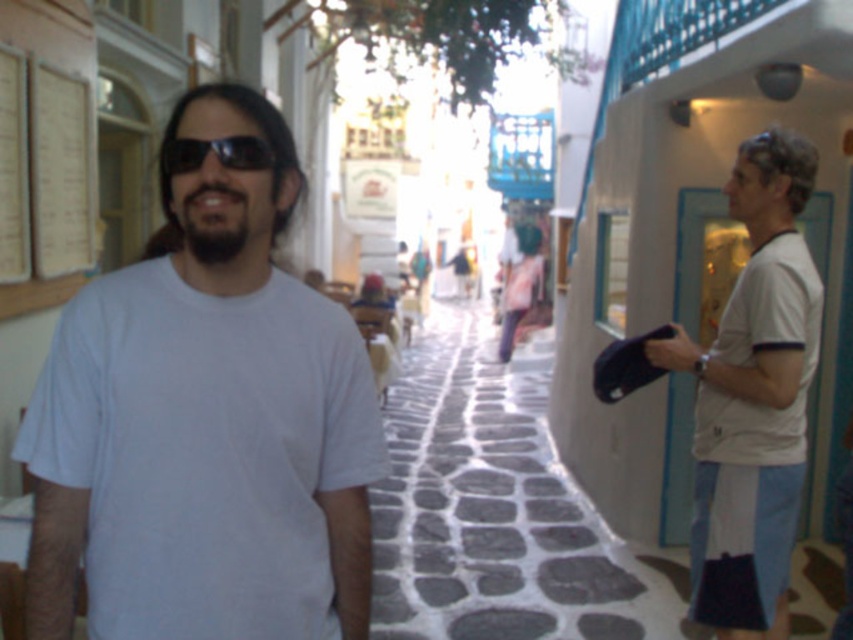
Question: Which point is closer to the camera?

Choices:
 (A) white matte t-shirt at center
 (B) white paper at left

Answer: (A)

Question: Which object is the farthest from the white paper at left?

Choices:
 (A) white cotton shirt at right
 (B) white matte t-shirt at center

Answer: (A)

Question: In this image, where is white cotton shirt at right located relative to black reflective sunglasses at center?

Choices:
 (A) below
 (B) above

Answer: (A)

Question: Is white matte t-shirt at center bigger than white cotton shirt at right?

Choices:
 (A) yes
 (B) no

Answer: (B)

Question: Based on their relative distances, which object is nearer to the black reflective sunglasses at center?

Choices:
 (A) white paper at left
 (B) white cotton shirt at right

Answer: (B)

Question: Does white matte t-shirt at center appear on the right side of white paper at left?

Choices:
 (A) yes
 (B) no

Answer: (A)